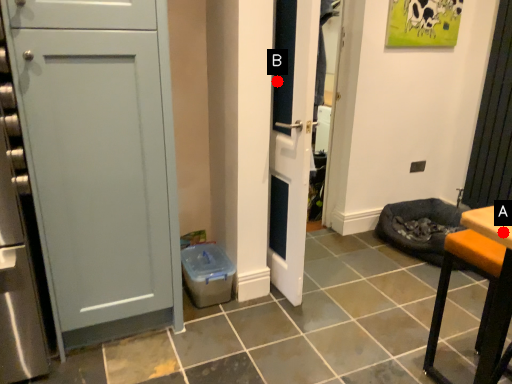
Question: Two points are circled on the image, labeled by A and B beside each circle. Which point is farther to the camera?

Choices:
 (A) A is further
 (B) B is further

Answer: (B)